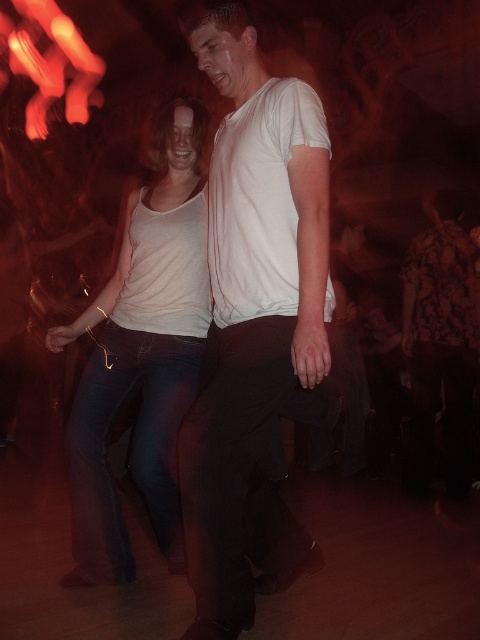
Between white matte t-shirt at center and white matte tank top at center, which one appears on the left side from the viewer's perspective?

Positioned to the left is white matte tank top at center.

Who is positioned more to the right, white matte t-shirt at center or white matte tank top at center?

From the viewer's perspective, white matte t-shirt at center appears more on the right side.

Where is `white matte t-shirt at center`? white matte t-shirt at center is located at coordinates (252, 317).

Find the location of a particular element. The image size is (480, 640). white matte t-shirt at center is located at coordinates (252, 317).